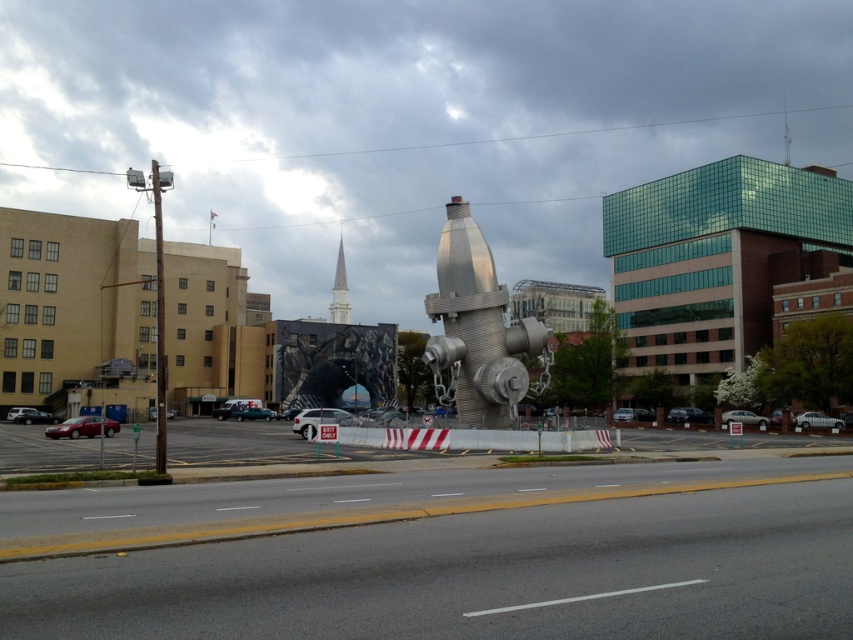
Question: Which object appears closest to the camera in this image?

Choices:
 (A) brushed metal fire hydrant at center
 (B) silver metallic spire at upper center

Answer: (A)

Question: Can you confirm if brushed metal fire hydrant at center is wider than silver metallic spire at upper center?

Choices:
 (A) no
 (B) yes

Answer: (A)

Question: Is brushed metal fire hydrant at center positioned at the back of silver metallic spire at upper center?

Choices:
 (A) yes
 (B) no

Answer: (B)

Question: Which of the following is the closest to the observer?

Choices:
 (A) (340, 269)
 (B) (480, 230)

Answer: (B)

Question: Is brushed metal fire hydrant at center positioned at the back of silver metallic spire at upper center?

Choices:
 (A) yes
 (B) no

Answer: (B)